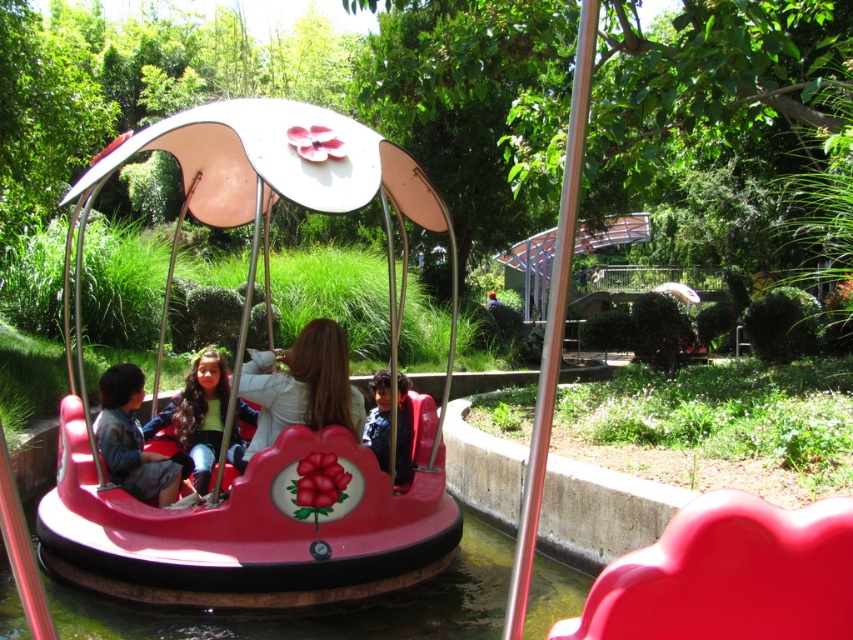
Which is behind, point (202, 488) or point (384, 442)?

The point (384, 442) is behind.

Does point (194, 358) lie in front of point (399, 481)?

That is False.

The height and width of the screenshot is (640, 853). Describe the element at coordinates (198, 413) in the screenshot. I see `matte pink hair at center` at that location.

This screenshot has width=853, height=640. I want to click on matte pink hair at center, so click(x=198, y=413).

Who is shorter, shiny plastic bumper car at center or matte pink hair at center?

matte pink hair at center

Measure the distance between shiny plastic bumper car at center and camera.

3.41 meters

Locate an element on the screen. shiny plastic bumper car at center is located at coordinates (260, 525).

Find the location of `matte white jacket at center`. matte white jacket at center is located at coordinates (300, 387).

Looking at this image, does matte white jacket at center appear under matte pink hair at center?

Actually, matte white jacket at center is above matte pink hair at center.

What are the coordinates of `matte white jacket at center` in the screenshot? It's located at (300, 387).